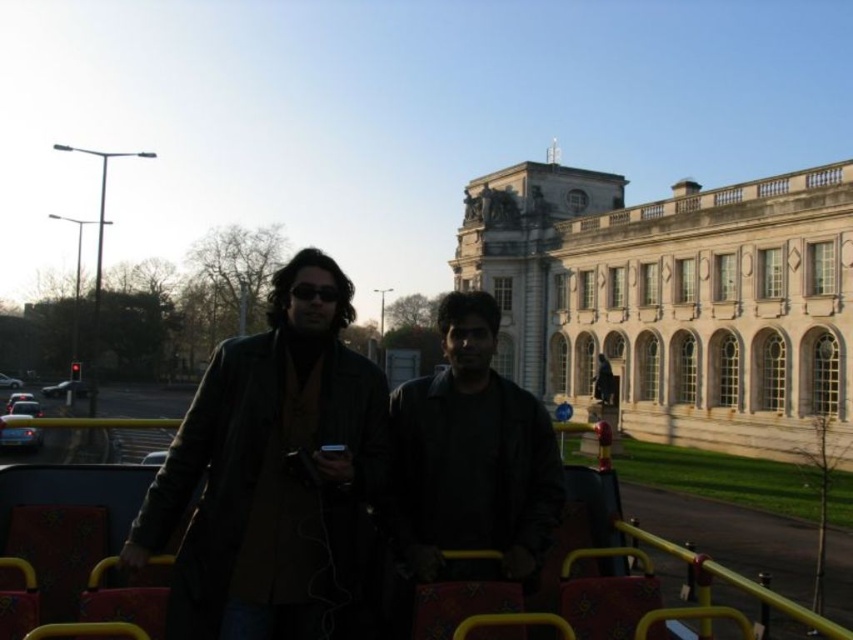
Does white stone building at center have a lesser width compared to black matte jacket at center?

No.

Who is shorter, white stone building at center or black matte jacket at center?

With less height is black matte jacket at center.

Which is behind, point (550, 218) or point (471, 472)?

Point (550, 218)

Locate an element on the screen. The width and height of the screenshot is (853, 640). white stone building at center is located at coordinates (674, 300).

Between point (531, 385) and point (308, 420), which one is positioned behind?

The point (531, 385) is more distant.

Is white stone building at center bigger than matte black jacket at center?

Yes.

Find the location of a particular element. This screenshot has width=853, height=640. white stone building at center is located at coordinates (674, 300).

Is matte black jacket at center smaller than black matte goggles at center?

No, matte black jacket at center is not smaller than black matte goggles at center.

Is matte black jacket at center taller than black matte goggles at center?

Correct, matte black jacket at center is much taller as black matte goggles at center.

Is point (343, 316) farther from viewer compared to point (325, 292)?

Yes, it is behind point (325, 292).

I want to click on matte black jacket at center, so click(x=282, y=481).